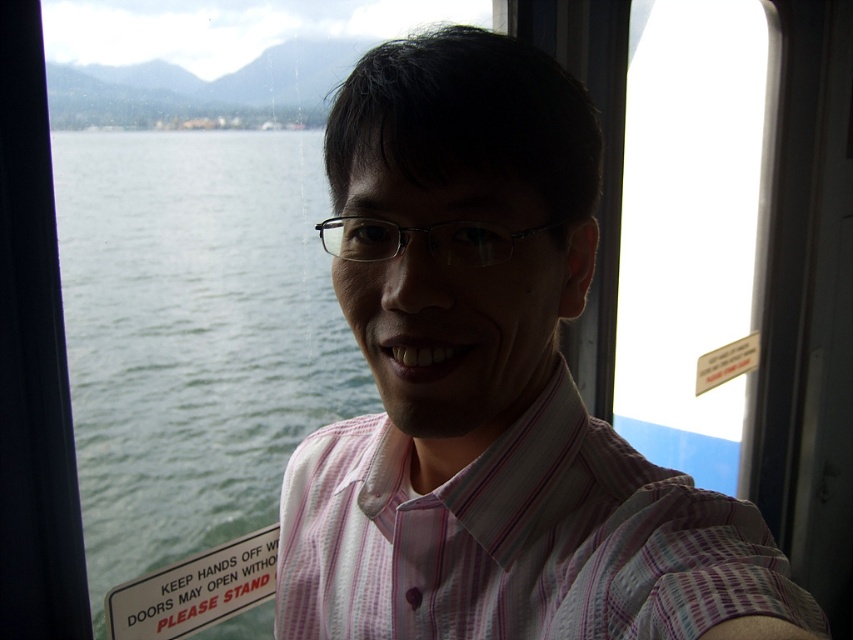
Can you confirm if green water at left is smaller than pink striped dress shirt at center?

No.

Who is taller, green water at left or pink striped dress shirt at center?

With more height is green water at left.

Is point (173, 340) closer to viewer compared to point (294, 541)?

No, it is not.

At what (x,y) coordinates should I click in order to perform the action: click on green water at left. Please return your answer as a coordinate pair (x, y). Looking at the image, I should click on (193, 336).

Does pink striped shirt at center appear over pink striped dress shirt at center?

Indeed, pink striped shirt at center is positioned over pink striped dress shirt at center.

Is point (595, 576) less distant than point (485, 632)?

Yes.

Between point (416, 138) and point (751, 570), which one is positioned behind?

The point (416, 138) is more distant.

Image resolution: width=853 pixels, height=640 pixels. Find the location of `pink striped shirt at center`. pink striped shirt at center is located at coordinates (491, 388).

Looking at this image, is pink striped shirt at center behind green water at left?

No, it is not.

Who is positioned more to the right, pink striped shirt at center or green water at left?

pink striped shirt at center is more to the right.

Between point (509, 480) and point (224, 401), which one is positioned behind?

The point (224, 401) is more distant.

Identify the location of pink striped shirt at center. (491, 388).